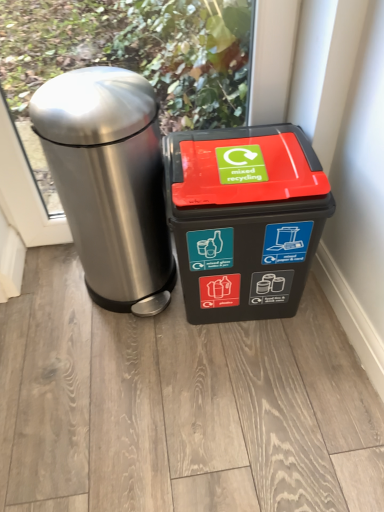
Locate an element on the screen. This screenshot has height=512, width=384. free location in front of black plastic recycling bin at center, which is the 2th waste container from left to right is located at coordinates (246, 375).